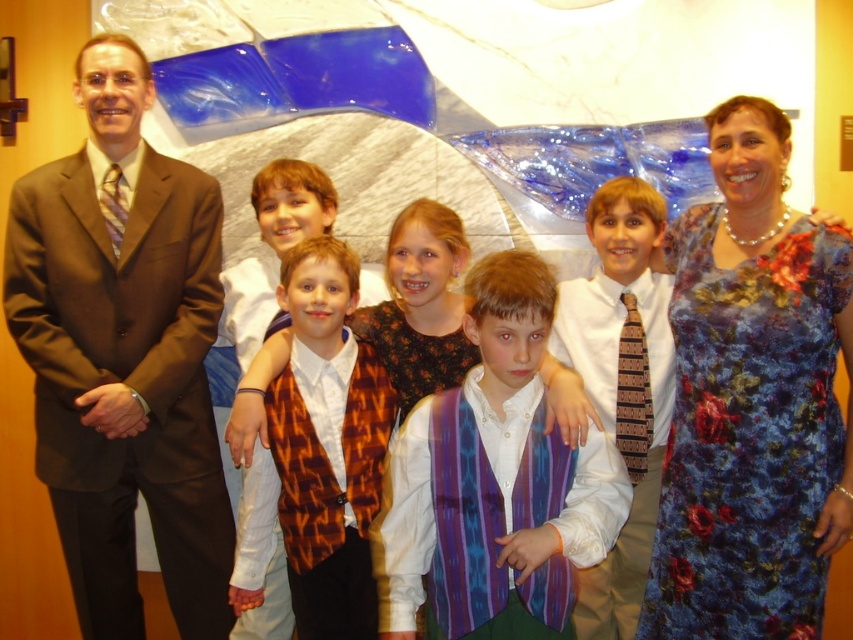
Question: Among these points, which one is nearest to the camera?

Choices:
 (A) (778, 529)
 (B) (76, 170)
 (C) (577, 486)
 (D) (624, 337)

Answer: (C)

Question: From the image, what is the correct spatial relationship of brown suit at left in relation to purple striped vest at center?

Choices:
 (A) below
 (B) above

Answer: (B)

Question: Among these objects, which one is farthest from the camera?

Choices:
 (A) orange patterned vest at center
 (B) floral silk dress at right
 (C) purple striped vest at center

Answer: (A)

Question: Considering the real-world distances, which object is closest to the purple striped vest at center?

Choices:
 (A) orange patterned vest at center
 (B) brown striped tie at center
 (C) brown suit at left
 (D) floral silk dress at right

Answer: (A)

Question: Does floral silk dress at right lie behind purple striped vest at center?

Choices:
 (A) no
 (B) yes

Answer: (B)

Question: Can you confirm if brown suit at left is bigger than floral silk dress at right?

Choices:
 (A) no
 (B) yes

Answer: (B)